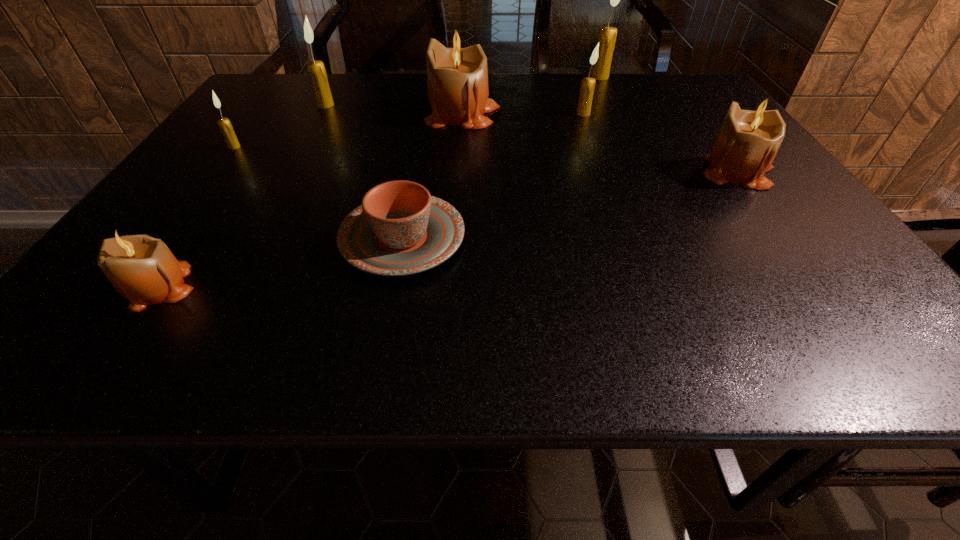
Find the location of a particular element. The height and width of the screenshot is (540, 960). vacant space that's between the shortest object and the tallest candle is located at coordinates (501, 158).

The image size is (960, 540). Identify the location of object that is the seventh closest one to the third biggest cream candle. (142, 269).

Locate an element on the screen. This screenshot has height=540, width=960. object that is the fifth closest to the farthest cream candle is located at coordinates (316, 69).

At what (x,y) coordinates should I click in order to perform the action: click on candle that can be found as the closest to the nearest beige candle. Please return your answer as a coordinate pair (x, y). The height and width of the screenshot is (540, 960). Looking at the image, I should click on pyautogui.click(x=226, y=128).

At what (x,y) coordinates should I click in order to perform the action: click on candle that is the sixth closest to the nearest cream candle. Please return your answer as a coordinate pair (x, y). The width and height of the screenshot is (960, 540). Looking at the image, I should click on (748, 140).

Locate an element on the screen. This screenshot has height=540, width=960. cream candle that is the second closest to the rightmost cream candle is located at coordinates (316, 69).

In order to click on cream candle that is the second closest one to the leftmost beige candle in this screenshot , I will do `click(316, 69)`.

Select which beige candle is the third closest to the sixth object from right to left. Please provide its 2D coordinates. Your answer should be formatted as a tuple, i.e. [(x, y)], where the tuple contains the x and y coordinates of a point satisfying the conditions above.

[(748, 140)]

Select which beige candle appears as the closest to the third candle from right to left. Please provide its 2D coordinates. Your answer should be formatted as a tuple, i.e. [(x, y)], where the tuple contains the x and y coordinates of a point satisfying the conditions above.

[(457, 77)]

Locate an element on the screen. blank space that satisfies the following two spatial constraints: 1. on the handle side of the third biggest cream candle; 2. on the left side of the chinaware is located at coordinates tap(425, 114).